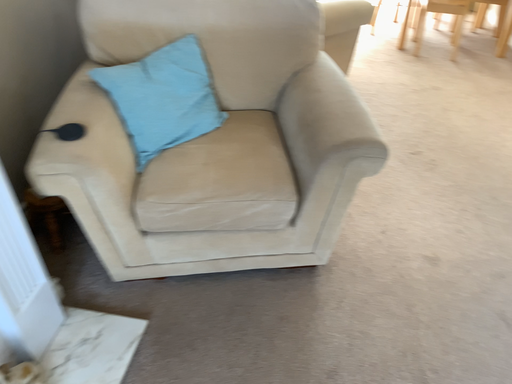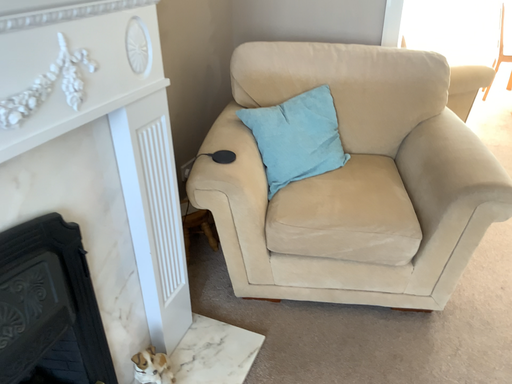
Question: Which way did the camera rotate in the video?

Choices:
 (A) rotated upward
 (B) rotated downward

Answer: (A)